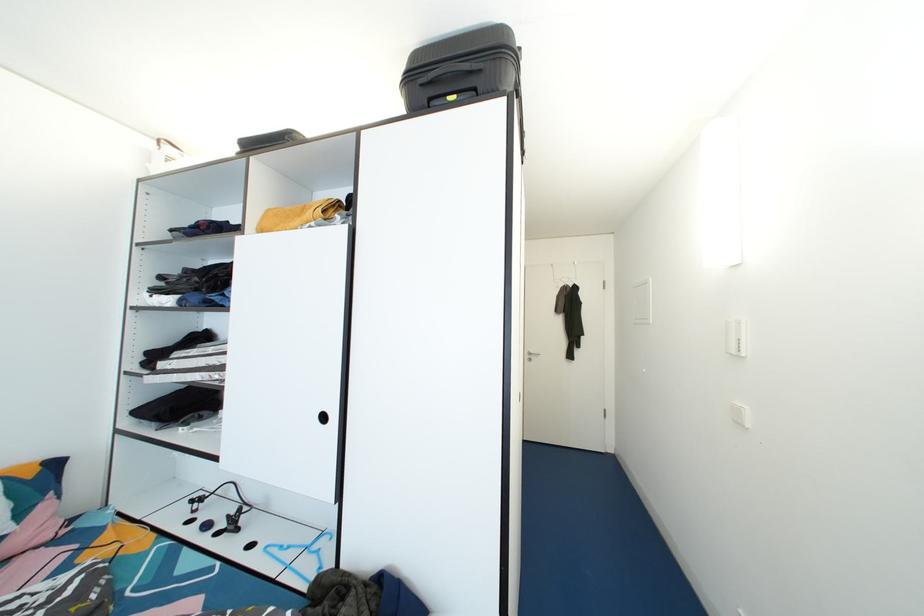
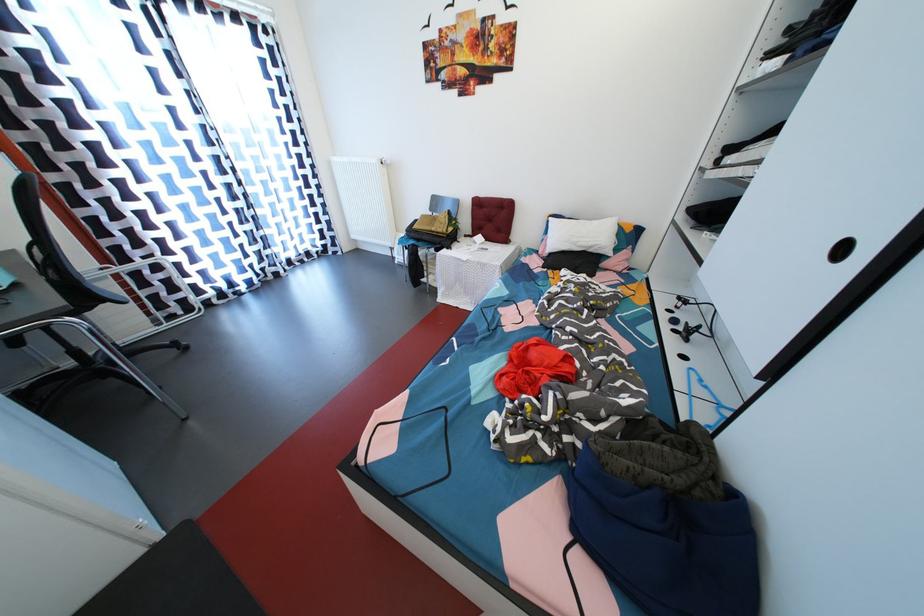
Where in the second image is the point corresponding to pixel 331 423 from the first image?

(848, 254)